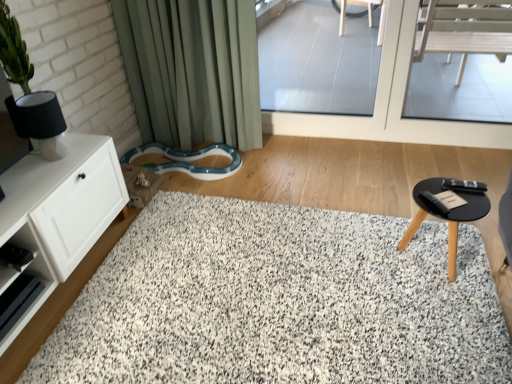
This screenshot has width=512, height=384. I want to click on vacant area that is in front of black matte table at lower right, so click(440, 306).